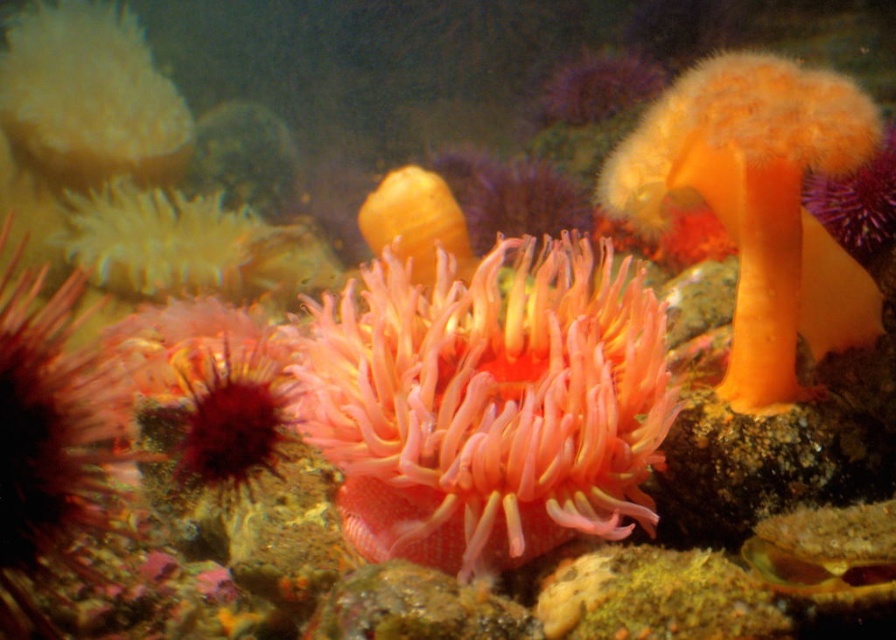
Question: Does pink soft coral at center come in front of orange soft coral at upper right?

Choices:
 (A) yes
 (B) no

Answer: (A)

Question: Is pink soft coral at center above yellow rubber duck at center?

Choices:
 (A) no
 (B) yes

Answer: (A)

Question: Is pink soft coral at center above orange soft coral at upper right?

Choices:
 (A) no
 (B) yes

Answer: (A)

Question: Based on their relative distances, which object is nearer to the yellow rubber duck at center?

Choices:
 (A) orange soft coral at upper right
 (B) pink soft coral at center

Answer: (B)

Question: Which point is farther to the camera?

Choices:
 (A) yellow rubber duck at center
 (B) pink soft coral at center

Answer: (A)

Question: Which of the following is the farthest from the observer?

Choices:
 (A) orange soft coral at upper right
 (B) pink soft coral at center
 (C) yellow rubber duck at center

Answer: (C)